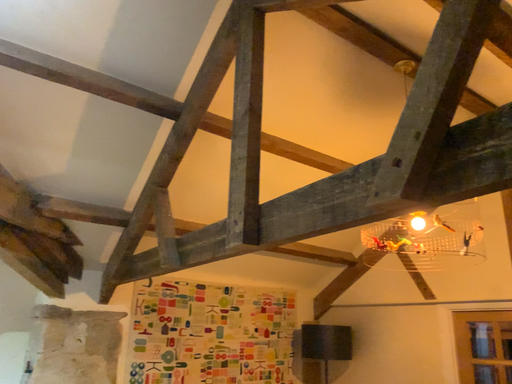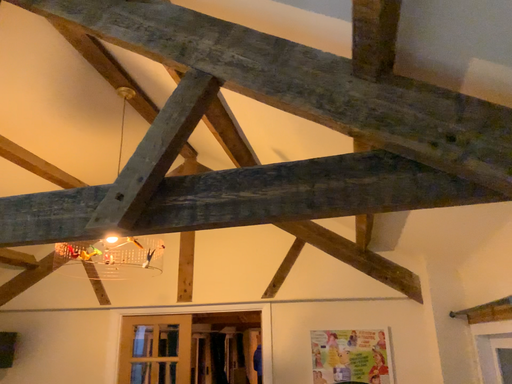
Question: Which way did the camera rotate in the video?

Choices:
 (A) rotated right
 (B) rotated left

Answer: (A)